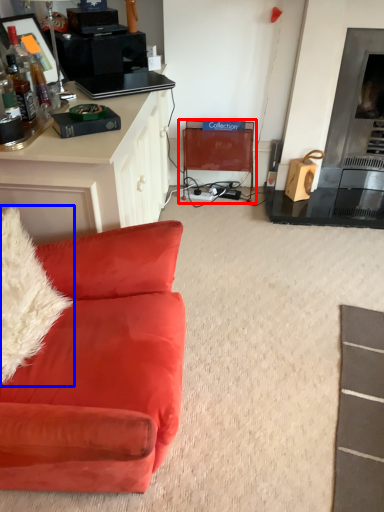
Question: Among these objects, which one is farthest to the camera, swivel chair (highlighted by a red box) or pillow (highlighted by a blue box)?

Choices:
 (A) swivel chair
 (B) pillow

Answer: (A)